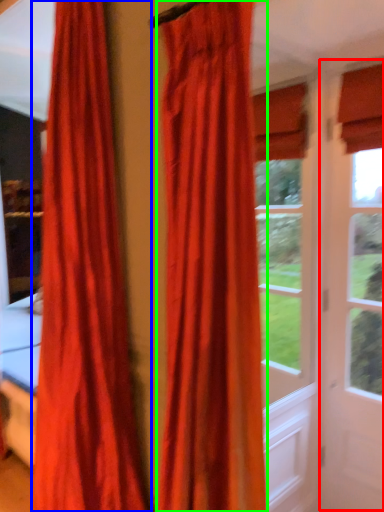
Question: Based on their relative distances, which object is farther from screen door (highlighted by a red box)? Choose from curtain (highlighted by a blue box) and curtain (highlighted by a green box).

Choices:
 (A) curtain
 (B) curtain

Answer: (A)